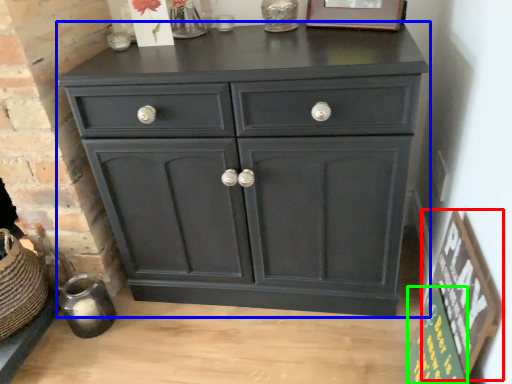
Question: Which object is positioned farthest from bulletin board (highlighted by a red box)? Select from chest of drawers (highlighted by a blue box) and bulletin board (highlighted by a green box).

Choices:
 (A) chest of drawers
 (B) bulletin board

Answer: (A)